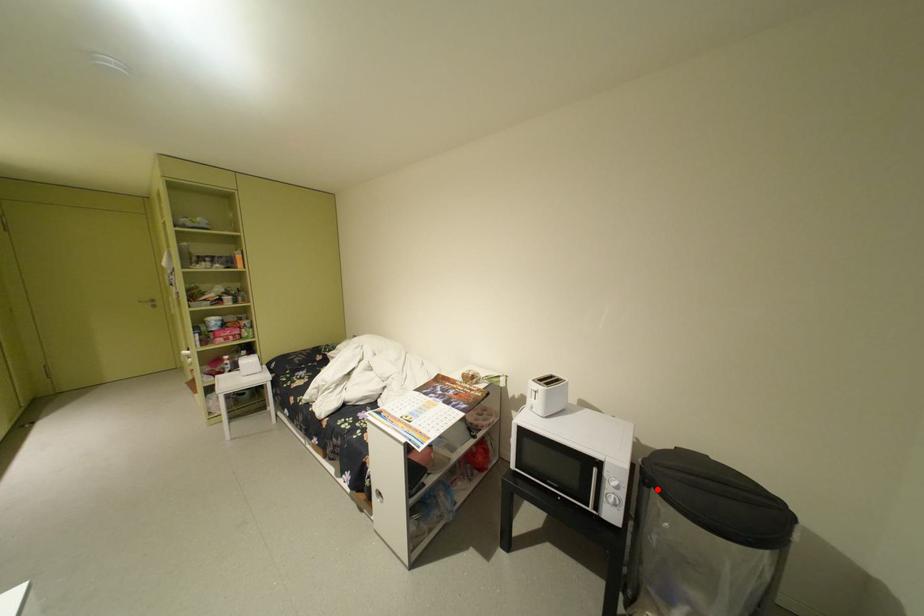
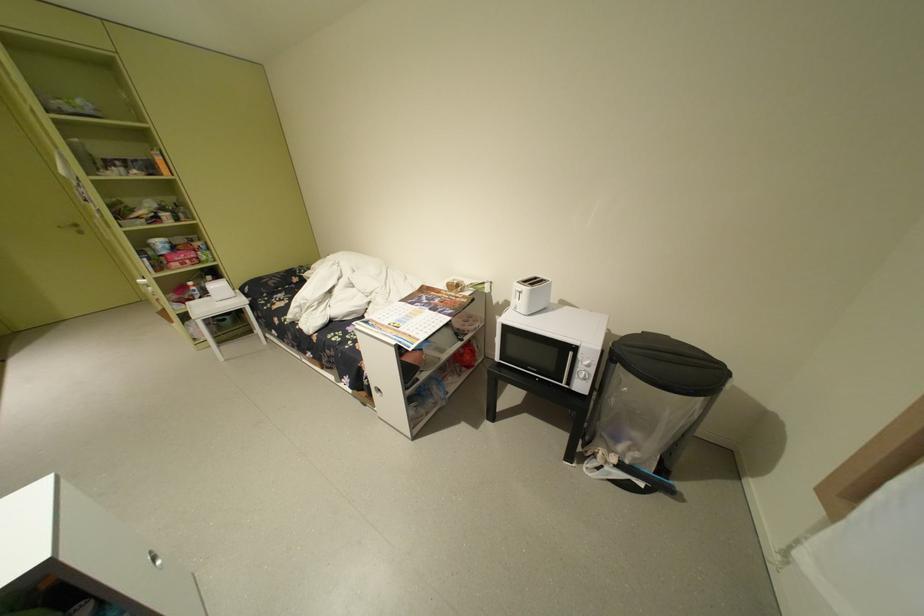
Find the pixel in the second image that matches the highlighted location in the first image.

(624, 365)